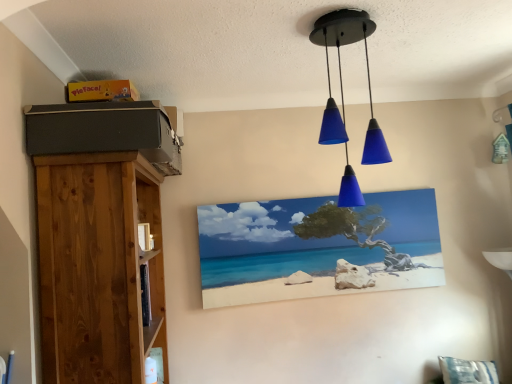
Question: Is blue glass pendant lights at upper center wider or thinner than natural wood bookshelf at left?

Choices:
 (A) wide
 (B) thin

Answer: (B)

Question: Considering their positions, is blue glass pendant lights at upper center located in front of or behind natural wood bookshelf at left?

Choices:
 (A) front
 (B) behind

Answer: (B)

Question: Which of these objects is positioned farthest from the natural wood bookshelf at left?

Choices:
 (A) matte canvas painting at center
 (B) blue glass pendant lights at upper center

Answer: (A)

Question: Which is farther from the natural wood bookshelf at left?

Choices:
 (A) blue glass pendant lights at upper center
 (B) matte canvas painting at center

Answer: (B)